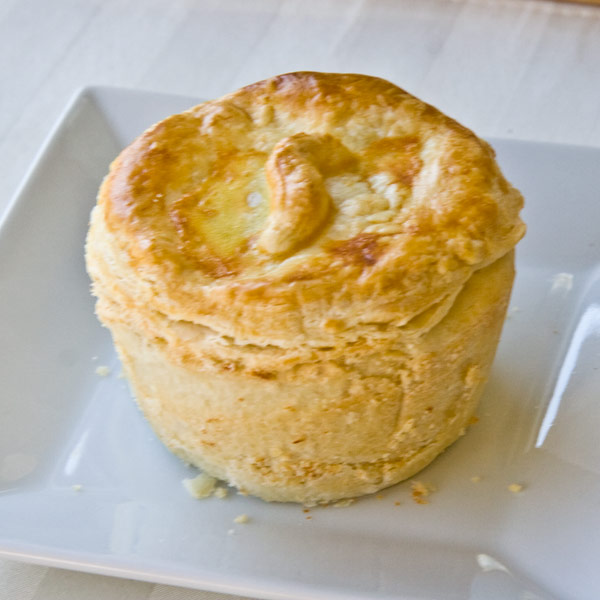
In order to click on white tablecloth in this screenshot , I will do `click(40, 581)`, `click(102, 587)`, `click(21, 120)`, `click(34, 26)`, `click(202, 21)`, `click(227, 65)`, `click(389, 24)`, `click(539, 44)`, `click(527, 100)`, `click(571, 101)`.